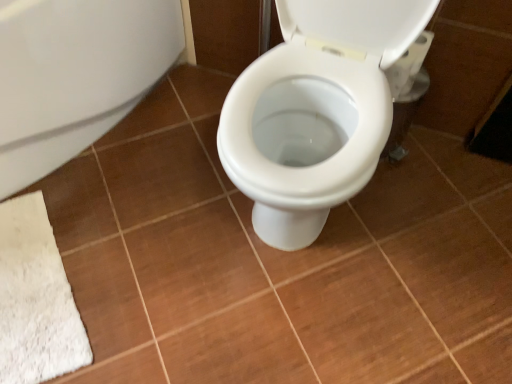
Image resolution: width=512 pixels, height=384 pixels. Identify the location of white matte toilet paper at upper right. (408, 66).

Describe the element at coordinates (408, 66) in the screenshot. I see `white matte toilet paper at upper right` at that location.

In order to face white matte toilet paper at upper right, should I rotate leftwards or rightwards?

To face it directly, rotate right by 20.366 degrees.

What do you see at coordinates (75, 75) in the screenshot?
I see `white matte bath at lower left` at bounding box center [75, 75].

The image size is (512, 384). I want to click on white matte bath at lower left, so click(75, 75).

You are a GUI agent. You are given a task and a screenshot of the screen. Output one action in this format:
    pyautogui.click(x=<x>, y=<y>)
    Task: Click on the white matte toilet paper at upper right
    The image size is (512, 384).
    Given the screenshot: What is the action you would take?
    pyautogui.click(x=408, y=66)

Is white matte bath at lower left at the left side of white matte toilet paper at upper right?

Indeed, white matte bath at lower left is positioned on the left side of white matte toilet paper at upper right.

Is white matte bath at lower left behind white matte toilet paper at upper right?

No, white matte bath at lower left is closer to the viewer.

Which is in front, point (42, 21) or point (389, 83)?

The point (42, 21) is in front.

From the image's perspective, which one is positioned higher, white matte bath at lower left or white matte toilet paper at upper right?

From the image's view, white matte toilet paper at upper right is above.

From a real-world perspective, which is physically above, white matte bath at lower left or white matte toilet paper at upper right?

white matte toilet paper at upper right is physically above.

Which object is thinner, white matte bath at lower left or white matte toilet paper at upper right?

white matte toilet paper at upper right is thinner.

Based on the photo, considering the relative sizes of white matte bath at lower left and white matte toilet paper at upper right in the image provided, is white matte bath at lower left taller than white matte toilet paper at upper right?

Correct, white matte bath at lower left is much taller as white matte toilet paper at upper right.

Considering the relative sizes of white matte bath at lower left and white matte toilet paper at upper right in the image provided, is white matte bath at lower left smaller than white matte toilet paper at upper right?

No, white matte bath at lower left is not smaller than white matte toilet paper at upper right.

Would you say white matte toilet paper at upper right is part of white matte bath at lower left's contents?

Actually, white matte toilet paper at upper right is outside white matte bath at lower left.

Are white matte bath at lower left and white matte toilet paper at upper right far apart?

They are positioned close to each other.

Is white matte bath at lower left oriented towards white matte toilet paper at upper right?

No, white matte bath at lower left is not oriented towards white matte toilet paper at upper right.

How much distance is there between white matte bath at lower left and white matte toilet paper at upper right?

33.15 inches.

Locate an element on the screen. The width and height of the screenshot is (512, 384). toilet paper above the white matte bath at lower left (from the image's perspective) is located at coordinates (408, 66).

Considering the relative positions of white matte toilet paper at upper right and white matte bath at lower left in the image provided, is white matte toilet paper at upper right to the left of white matte bath at lower left from the viewer's perspective?

No, white matte toilet paper at upper right is not to the left of white matte bath at lower left.

Considering their positions, is white matte toilet paper at upper right located in front of or behind white matte bath at lower left?

In the image, white matte toilet paper at upper right appears behind white matte bath at lower left.

Is point (423, 35) closer or farther from the camera than point (85, 114)?

Point (423, 35) appears to be closer to the viewer than point (85, 114).

From the image's perspective, which is above, white matte toilet paper at upper right or white matte bath at lower left?

white matte toilet paper at upper right, from the image's perspective.

From a real-world perspective, is white matte toilet paper at upper right on white matte bath at lower left?

Correct, in the physical world, white matte toilet paper at upper right is higher than white matte bath at lower left.

Considering the sizes of objects white matte toilet paper at upper right and white matte bath at lower left in the image provided, who is thinner, white matte toilet paper at upper right or white matte bath at lower left?

With smaller width is white matte toilet paper at upper right.

Considering the sizes of objects white matte toilet paper at upper right and white matte bath at lower left in the image provided, who is taller, white matte toilet paper at upper right or white matte bath at lower left?

white matte bath at lower left is taller.

From the picture: Can you confirm if white matte toilet paper at upper right is bigger than white matte bath at lower left?

Incorrect, white matte toilet paper at upper right is not larger than white matte bath at lower left.

In the scene shown: Would you say white matte toilet paper at upper right is outside white matte bath at lower left?

Yes, white matte toilet paper at upper right is located beyond the bounds of white matte bath at lower left.

Would you consider white matte toilet paper at upper right to be distant from white matte bath at lower left?

No, white matte toilet paper at upper right is not far from white matte bath at lower left.

Is white matte toilet paper at upper right oriented towards white matte bath at lower left?

No, white matte toilet paper at upper right does not turn towards white matte bath at lower left.

What are the coordinates of `toilet paper above the white matte bath at lower left (from the image's perspective)` in the screenshot? It's located at (408, 66).

The height and width of the screenshot is (384, 512). In order to click on toilet paper that is above the white matte bath at lower left (from a real-world perspective) in this screenshot , I will do `click(408, 66)`.

In order to click on bath in front of the white matte toilet paper at upper right in this screenshot , I will do [75, 75].